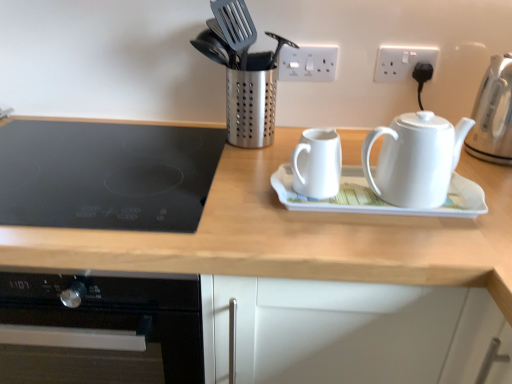
Question: Does white ceramic saucer at center have a larger size compared to white plastic electric outlet at upper right, the 2th electric outlet when ordered from left to right?

Choices:
 (A) no
 (B) yes

Answer: (B)

Question: From a real-world perspective, is white ceramic saucer at center on top of white plastic electric outlet at upper right, the 2th electric outlet when ordered from left to right?

Choices:
 (A) yes
 (B) no

Answer: (B)

Question: Is white ceramic saucer at center looking in the opposite direction of white plastic electric outlet at upper right, the 2th electric outlet when ordered from left to right?

Choices:
 (A) yes
 (B) no

Answer: (B)

Question: Is white ceramic saucer at center behind white plastic electric outlet at upper right, which is counted as the first electric outlet, starting from the right?

Choices:
 (A) no
 (B) yes

Answer: (A)

Question: Does white ceramic saucer at center come in front of white plastic electric outlet at upper right, which is counted as the first electric outlet, starting from the right?

Choices:
 (A) yes
 (B) no

Answer: (A)

Question: Considering the relative positions of white ceramic saucer at center and white plastic electric outlet at upper right, the 2th electric outlet when ordered from left to right, in the image provided, is white ceramic saucer at center to the left of white plastic electric outlet at upper right, the 2th electric outlet when ordered from left to right, from the viewer's perspective?

Choices:
 (A) yes
 (B) no

Answer: (A)

Question: From a real-world perspective, is satin silver kettle at right, the 1th kettle when ordered from right to left, positioned over white plastic socket at upper center, which appears as the second electric outlet when viewed from the right, based on gravity?

Choices:
 (A) yes
 (B) no

Answer: (B)

Question: Can you confirm if satin silver kettle at right, the 3th kettle in the left-to-right sequence, is positioned to the left of white plastic socket at upper center, the first electric outlet in the left-to-right sequence?

Choices:
 (A) no
 (B) yes

Answer: (A)

Question: Is white plastic socket at upper center, the first electric outlet in the left-to-right sequence, at the back of satin silver kettle at right, the 1th kettle when ordered from right to left?

Choices:
 (A) yes
 (B) no

Answer: (B)

Question: Are satin silver kettle at right, the 3th kettle in the left-to-right sequence, and white plastic socket at upper center, which appears as the second electric outlet when viewed from the right, beside each other?

Choices:
 (A) no
 (B) yes

Answer: (A)

Question: Is satin silver kettle at right, the 3th kettle in the left-to-right sequence, wider than white plastic socket at upper center, the first electric outlet in the left-to-right sequence?

Choices:
 (A) no
 (B) yes

Answer: (B)

Question: Is satin silver kettle at right, the 1th kettle when ordered from right to left, closer to camera compared to white plastic socket at upper center, the first electric outlet in the left-to-right sequence?

Choices:
 (A) no
 (B) yes

Answer: (B)

Question: Are white plastic socket at upper center, which appears as the second electric outlet when viewed from the right, and white ceramic saucer at center located far from each other?

Choices:
 (A) no
 (B) yes

Answer: (A)